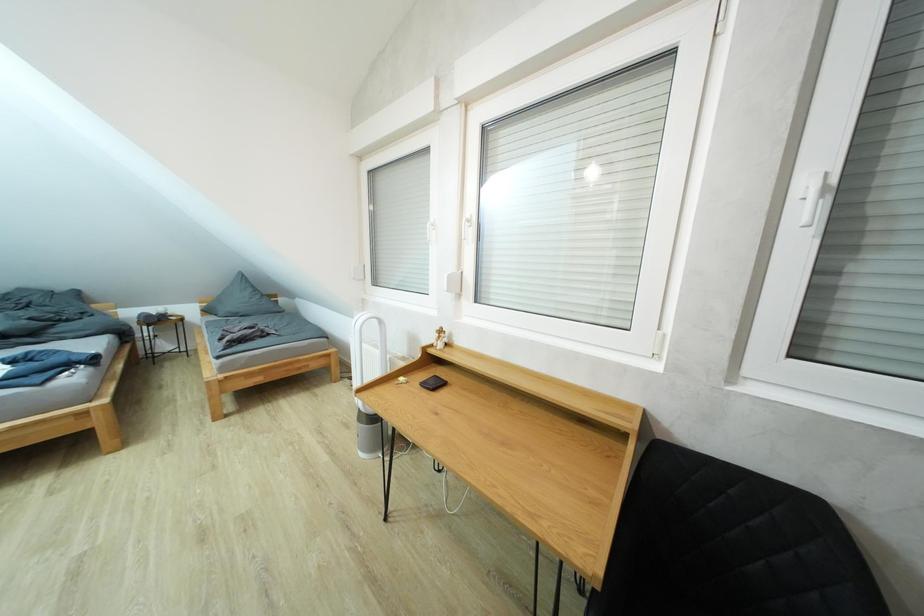
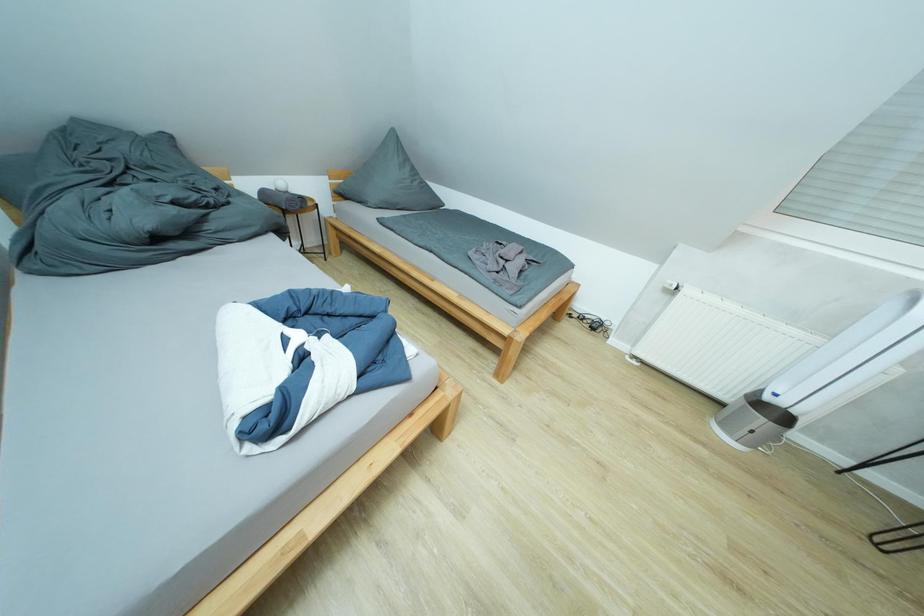
Question: In a continuous first-person perspective shot, in which direction is the camera moving?

Choices:
 (A) Left
 (B) Right
 (C) Forward
 (D) Backward

Answer: (A)